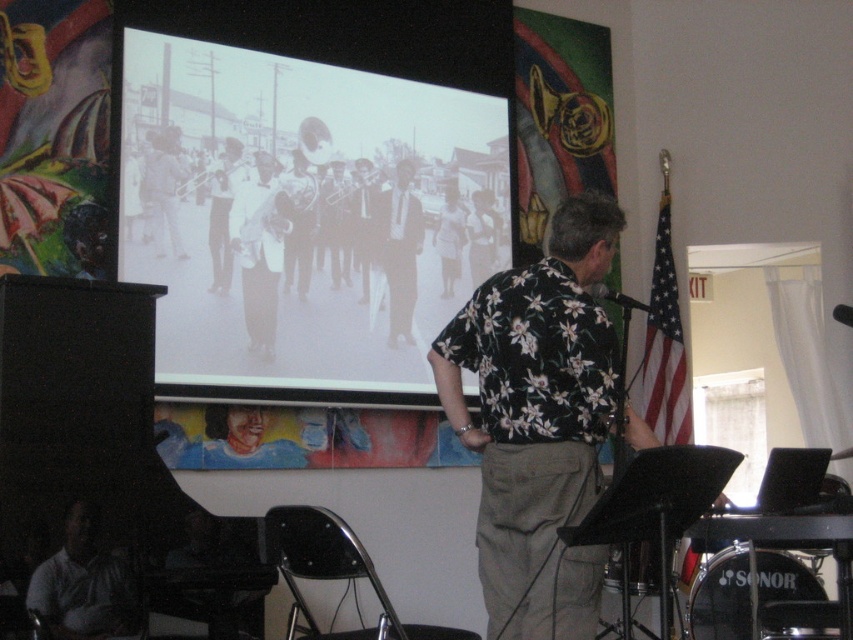
Question: Can you confirm if khaki pants at center is positioned to the left of dark suit at center?

Choices:
 (A) yes
 (B) no

Answer: (B)

Question: Can you confirm if light brown leather jacket at lower left is positioned to the left of matte black trombone at center?

Choices:
 (A) no
 (B) yes

Answer: (B)

Question: Which of these objects is positioned closest to the black matte projection screen at upper center?

Choices:
 (A) light brown leather jacket at lower left
 (B) khaki pants at center

Answer: (B)

Question: Which point is farther from the camera taking this photo?

Choices:
 (A) (97, 561)
 (B) (392, 241)
 (C) (334, 221)

Answer: (B)

Question: Can you confirm if dark suit at center is positioned to the right of matte black trombone at center?

Choices:
 (A) yes
 (B) no

Answer: (A)

Question: Which point appears farthest from the camera in this image?

Choices:
 (A) (42, 596)
 (B) (375, 228)
 (C) (227, 310)

Answer: (B)